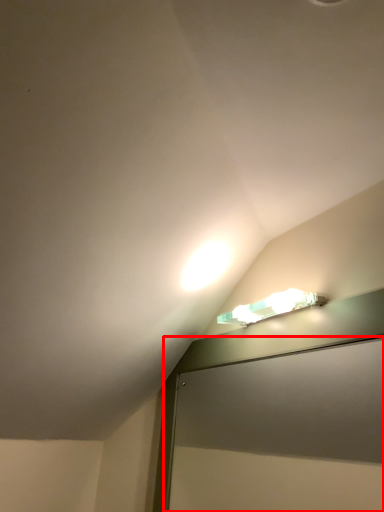
Question: From the image's perspective, what is the correct spatial positioning of screen door (annotated by the red box) in reference to lamp?

Choices:
 (A) below
 (B) above

Answer: (A)